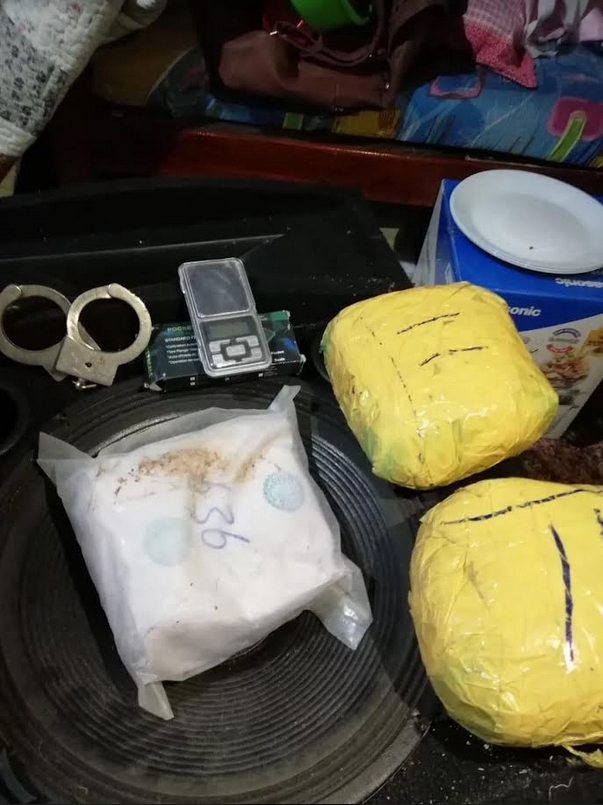
Find the location of a particular element. The width and height of the screenshot is (603, 805). white plate is located at coordinates (541, 217).